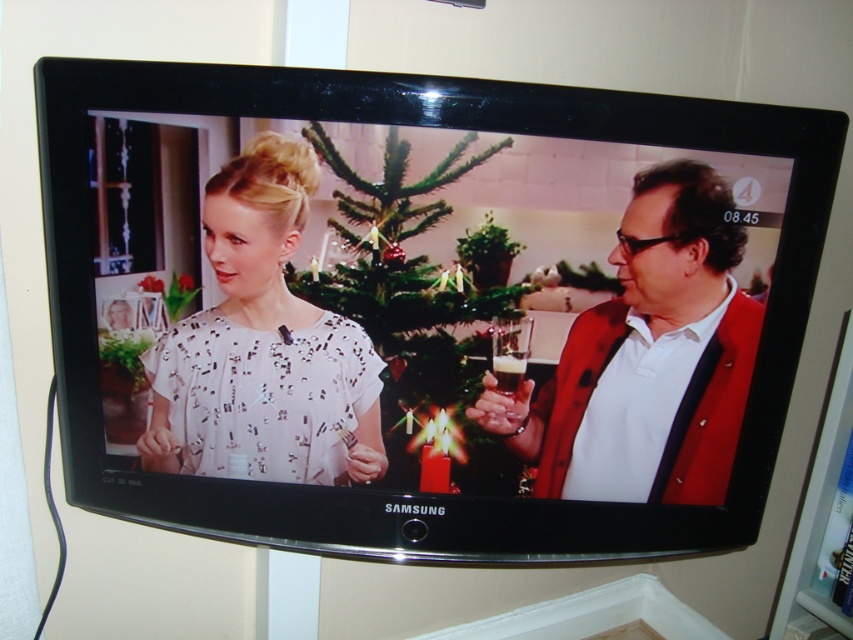
Question: Estimate the real-world distances between objects in this image. Which object is closer to the green matte christmas tree at center?

Choices:
 (A) brown glass at center
 (B) translucent glass wine glass at right
 (C) white sequined dress at center
 (D) white sequined blouse at center

Answer: (C)

Question: Can you confirm if green matte christmas tree at center is positioned to the left of translucent glass wine glass at right?

Choices:
 (A) yes
 (B) no

Answer: (A)

Question: Where is white sequined blouse at center located in relation to green matte christmas tree at center in the image?

Choices:
 (A) below
 (B) above

Answer: (A)

Question: Which is farther from the white sequined blouse at center?

Choices:
 (A) translucent glass wine glass at right
 (B) matte red blazer at right

Answer: (B)

Question: Can you confirm if white sequined dress at center is positioned to the right of white sequined blouse at center?

Choices:
 (A) yes
 (B) no

Answer: (A)

Question: Estimate the real-world distances between objects in this image. Which object is closer to the green matte christmas tree at center?

Choices:
 (A) white sequined dress at center
 (B) brown glass at center
 (C) white sequined blouse at center
 (D) matte red blazer at right

Answer: (A)